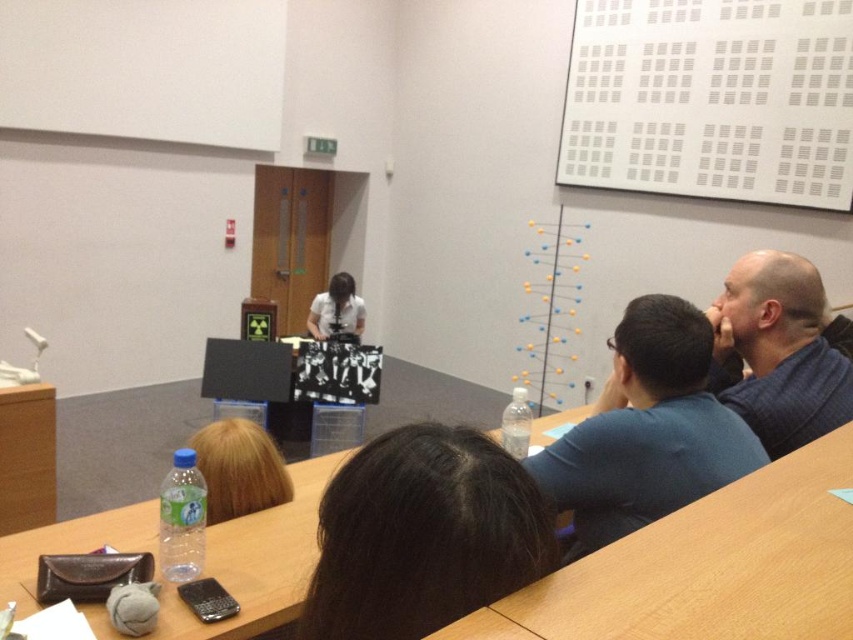
Who is taller, clear plastic table at lower center or matte white shirt at center?

matte white shirt at center is taller.

Can you confirm if clear plastic table at lower center is positioned below matte white shirt at center?

Correct, clear plastic table at lower center is located below matte white shirt at center.

Find the location of `clear plastic table at lower center`. clear plastic table at lower center is located at coordinates (258, 563).

Does white matte board at upper center lie in front of dark brown hair at center?

No, it is behind dark brown hair at center.

Can you confirm if white matte board at upper center is thinner than dark brown hair at center?

No.

Between point (675, 189) and point (415, 458), which one is positioned behind?

Point (675, 189)

Find the location of a particular element. This screenshot has width=853, height=640. white matte board at upper center is located at coordinates (711, 99).

Looking at this image, who is more distant from viewer, (833, 116) or (229, 435)?

The point (833, 116) is more distant.

Between point (741, 76) and point (222, 436), which one is positioned behind?

The point (741, 76) is behind.

Locate an element on the screen. This screenshot has height=640, width=853. white matte board at upper center is located at coordinates (711, 99).